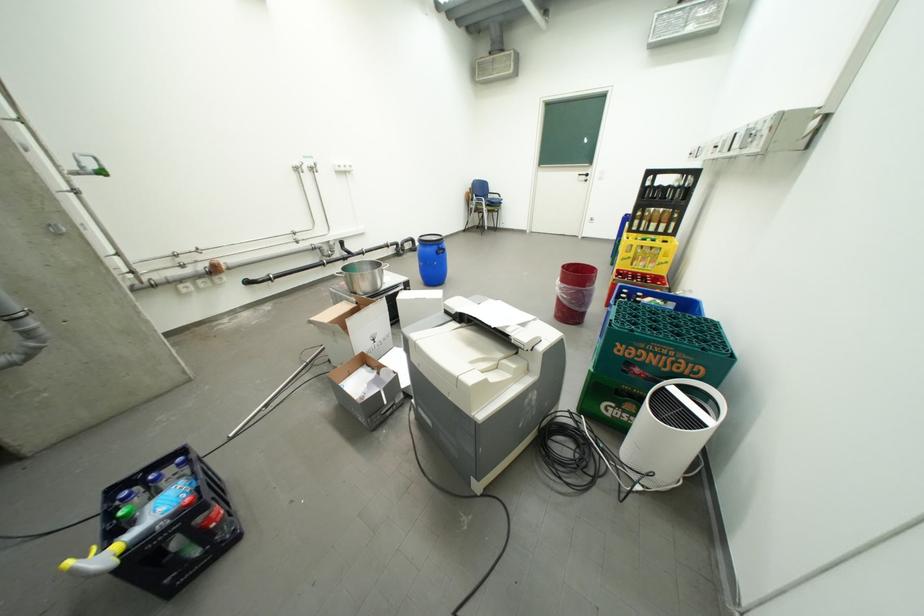
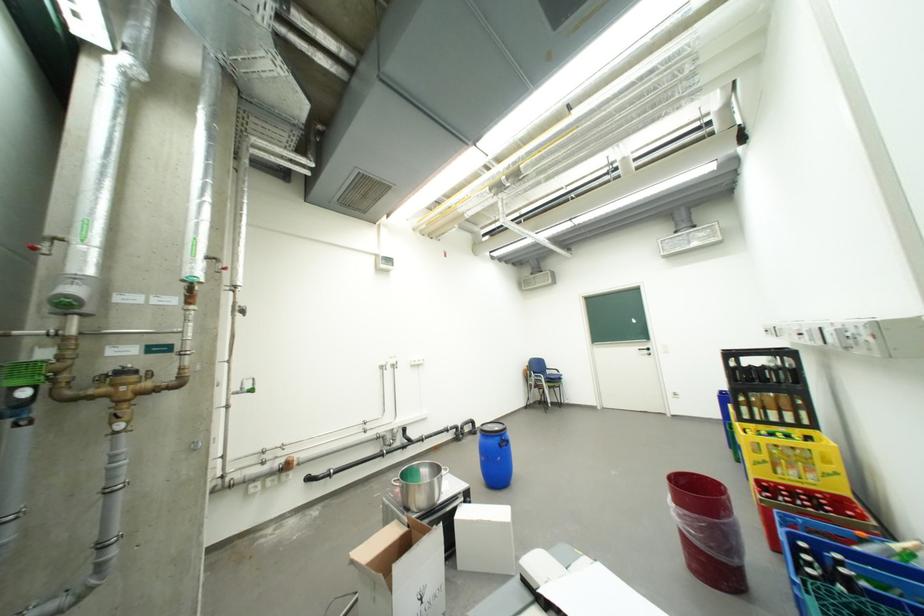
Question: I am providing you with two images of the same scene from different viewpoints. After the viewpoint changes to image2, which objects are now occluded?

Choices:
 (A) white light switch
 (B) yellow crate
 (C) cardboard box
 (D) none of these

Answer: (D)